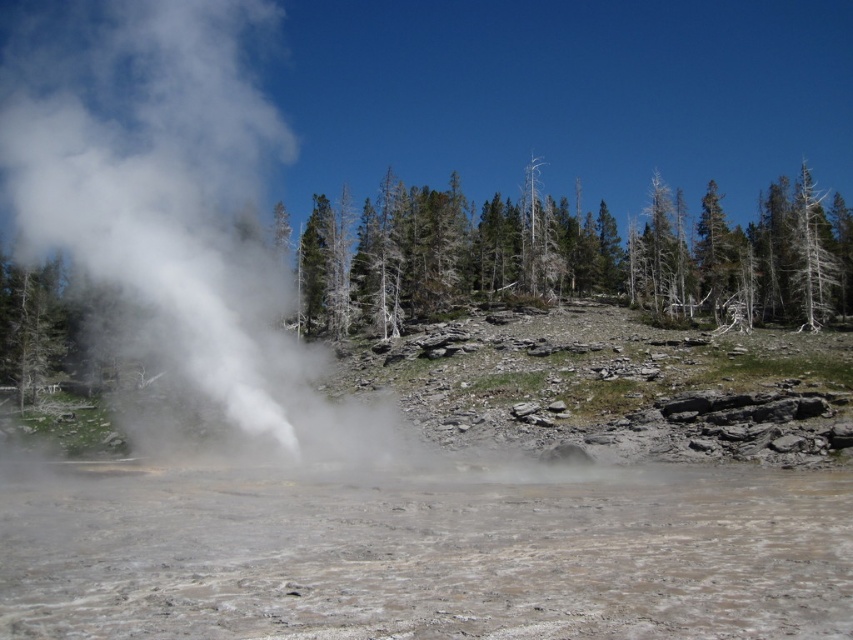
You are standing at the origin point of the coordinate system in the image. Which direction should you move to reach the muddy water at center?

The muddy water at center is located at coordinates point (428,556), so you should move towards the right and slightly forward to reach it.

You are standing at the point marked as point (170,198) in the image. What is the color of the substance located exactly at this point?

The substance at point (170,198) is white vapor.

Based on the scene description, where is the muddy water at center located in terms of its 2D coordinates?

The muddy water at center is located at the 2D coordinates of point (x=428, y=556).